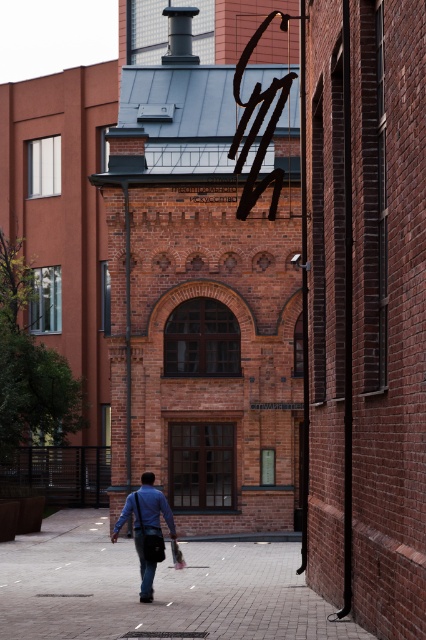
Does brick pavement at center have a larger size compared to blue fabric bag at center?

Yes.

Who is more distant from viewer, (236, 541) or (120, 529)?

The point (236, 541) is more distant.

Between point (250, 545) and point (141, 536), which one is positioned behind?

The point (250, 545) is behind.

Image resolution: width=426 pixels, height=640 pixels. Identify the location of brick pavement at center. (155, 588).